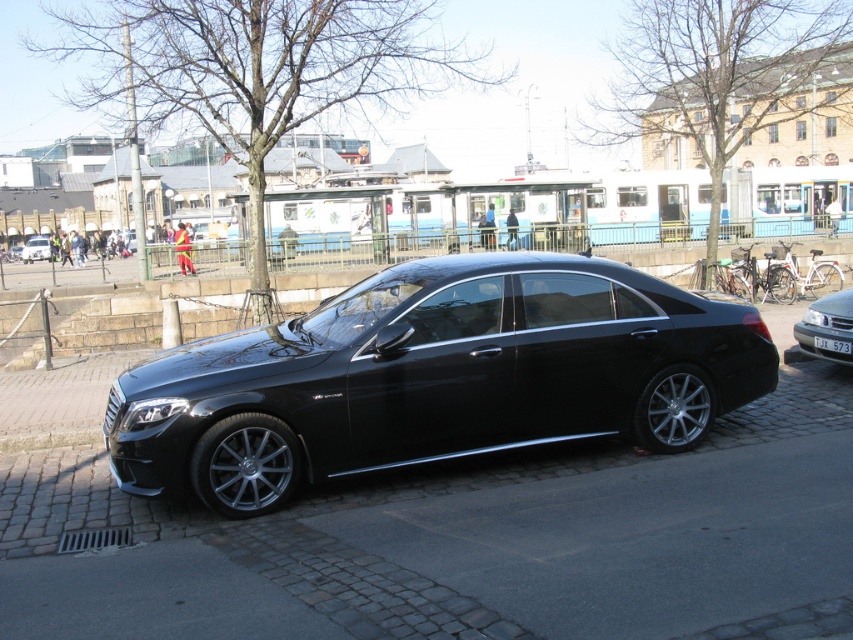
Question: Among these points, which one is farthest from the camera?

Choices:
 (A) (810, 324)
 (B) (47, 248)
 (C) (474, 538)
 (D) (566, 422)

Answer: (B)

Question: Which point is closer to the camera taking this photo?

Choices:
 (A) 379,547
 (B) 120,465
 (C) 33,241
 (D) 831,349

Answer: (A)

Question: Which point appears closest to the camera in this image?

Choices:
 (A) (90, 595)
 (B) (224, 392)
 (C) (846, 349)
 (D) (830, 298)

Answer: (A)

Question: Is black asphalt at center positioned behind black metallic sedan at center?

Choices:
 (A) no
 (B) yes

Answer: (A)

Question: Does glossy black car at center appear on the left side of black plastic license plate at center?

Choices:
 (A) no
 (B) yes

Answer: (B)

Question: Can you confirm if black asphalt at center is positioned to the left of black metallic sedan at center?

Choices:
 (A) yes
 (B) no

Answer: (A)